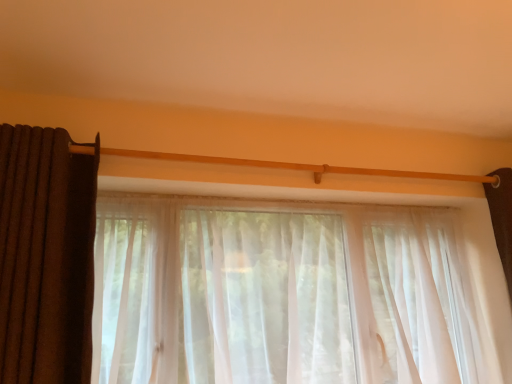
Question: Is point (53, 215) positioned closer to the camera than point (26, 261)?

Choices:
 (A) farther
 (B) closer

Answer: (A)

Question: Is sheer white curtain at center, which is the first curtain in right-to-left order, taller or shorter than brown textured curtain at left, the 1th curtain positioned from the left?

Choices:
 (A) tall
 (B) short

Answer: (A)

Question: Would you say sheer white curtain at center, marked as the 2th curtain in a left-to-right arrangement, is to the left or to the right of brown textured curtain at left, arranged as the second curtain when viewed from the right, in the picture?

Choices:
 (A) right
 (B) left

Answer: (A)

Question: Based on their sizes in the image, would you say brown textured curtain at left, arranged as the second curtain when viewed from the right, is bigger or smaller than sheer white curtain at center, marked as the 2th curtain in a left-to-right arrangement?

Choices:
 (A) big
 (B) small

Answer: (B)

Question: Is brown textured curtain at left, the 1th curtain positioned from the left, in front of or behind sheer white curtain at center, marked as the 2th curtain in a left-to-right arrangement, in the image?

Choices:
 (A) front
 (B) behind

Answer: (A)

Question: From a real-world perspective, is brown textured curtain at left, arranged as the second curtain when viewed from the right, above or below sheer white curtain at center, which is the first curtain in right-to-left order?

Choices:
 (A) above
 (B) below

Answer: (A)

Question: Is brown textured curtain at left, arranged as the second curtain when viewed from the right, inside the boundaries of sheer white curtain at center, which is the first curtain in right-to-left order, or outside?

Choices:
 (A) outside
 (B) inside

Answer: (A)